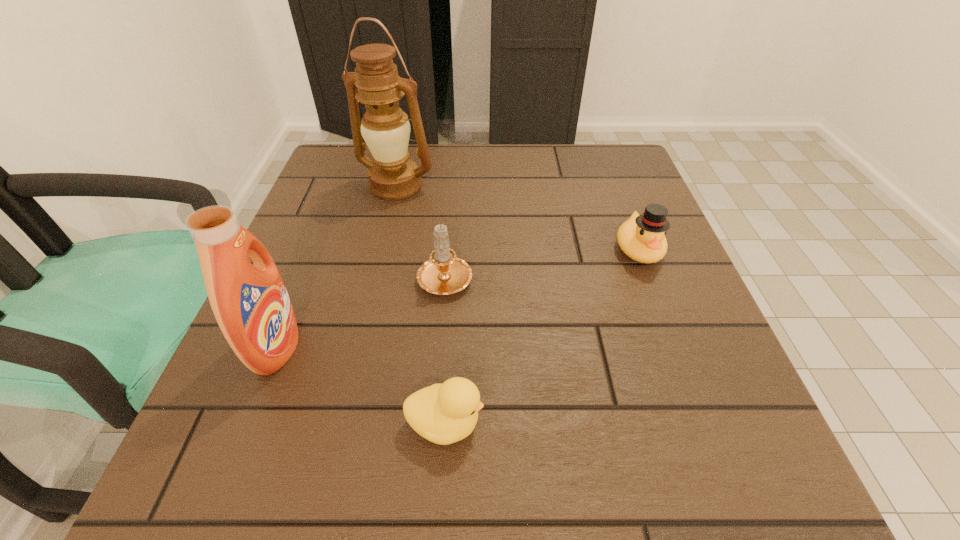
This screenshot has height=540, width=960. What are the coordinates of `vacant area situated 0.170m on the front-facing side of the second nearest object` in the screenshot? It's located at (399, 347).

What are the coordinates of `free region located on the left of the candle` in the screenshot? It's located at (361, 276).

Where is `free location located 0.090m on the front-facing side of the farther duck`? free location located 0.090m on the front-facing side of the farther duck is located at coordinates tap(661, 309).

The image size is (960, 540). Find the location of `free region located on the front-facing side of the left duck`. free region located on the front-facing side of the left duck is located at coordinates (672, 424).

Locate an element on the screen. The image size is (960, 540). object present at the far edge is located at coordinates (385, 128).

Where is `object situated at the near edge`? object situated at the near edge is located at coordinates (445, 413).

At what (x,y) coordinates should I click in order to perform the action: click on oil lamp positioned at the left edge. Please return your answer as a coordinate pair (x, y). Image resolution: width=960 pixels, height=540 pixels. Looking at the image, I should click on (385, 128).

Where is `detergent that is at the left edge`? The image size is (960, 540). detergent that is at the left edge is located at coordinates (251, 305).

I want to click on object that is positioned at the right edge, so click(x=642, y=237).

Identify the location of object present at the far left corner. This screenshot has width=960, height=540. (385, 128).